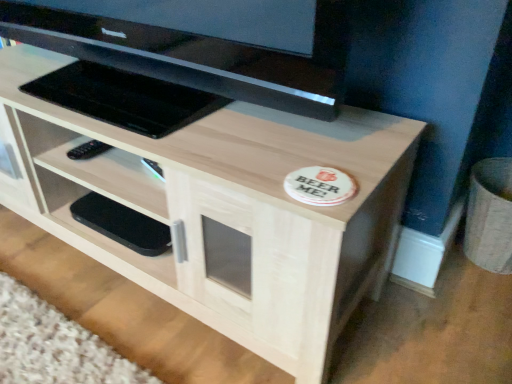
Question: Considering the relative positions of light wood/texture tv stand at center and black matte phone at lower left in the image provided, is light wood/texture tv stand at center to the right of black matte phone at lower left from the viewer's perspective?

Choices:
 (A) yes
 (B) no

Answer: (A)

Question: Is light wood/texture tv stand at center looking in the opposite direction of black matte phone at lower left?

Choices:
 (A) yes
 (B) no

Answer: (A)

Question: Does light wood/texture tv stand at center lie in front of black matte phone at lower left?

Choices:
 (A) yes
 (B) no

Answer: (A)

Question: Is light wood/texture tv stand at center bigger than black matte phone at lower left?

Choices:
 (A) yes
 (B) no

Answer: (A)

Question: Could black matte phone at lower left be considered to be inside light wood/texture tv stand at center?

Choices:
 (A) no
 (B) yes

Answer: (B)

Question: Considering the relative sizes of light wood/texture tv stand at center and black matte phone at lower left in the image provided, is light wood/texture tv stand at center taller than black matte phone at lower left?

Choices:
 (A) yes
 (B) no

Answer: (A)

Question: From a real-world perspective, is black matte phone at lower left below black glossy television at upper center?

Choices:
 (A) no
 (B) yes

Answer: (B)

Question: Considering the relative sizes of black matte phone at lower left and black glossy television at upper center in the image provided, is black matte phone at lower left thinner than black glossy television at upper center?

Choices:
 (A) no
 (B) yes

Answer: (B)

Question: Is black matte phone at lower left not inside black glossy television at upper center?

Choices:
 (A) no
 (B) yes

Answer: (B)

Question: Is black matte phone at lower left surrounding black glossy television at upper center?

Choices:
 (A) yes
 (B) no

Answer: (B)

Question: Does black matte phone at lower left have a larger size compared to black glossy television at upper center?

Choices:
 (A) yes
 (B) no

Answer: (B)

Question: Considering the relative positions of black matte phone at lower left and black glossy television at upper center in the image provided, is black matte phone at lower left in front of black glossy television at upper center?

Choices:
 (A) yes
 (B) no

Answer: (B)

Question: From the image's perspective, is light wood/texture tv stand at center over black glossy television at upper center?

Choices:
 (A) yes
 (B) no

Answer: (B)